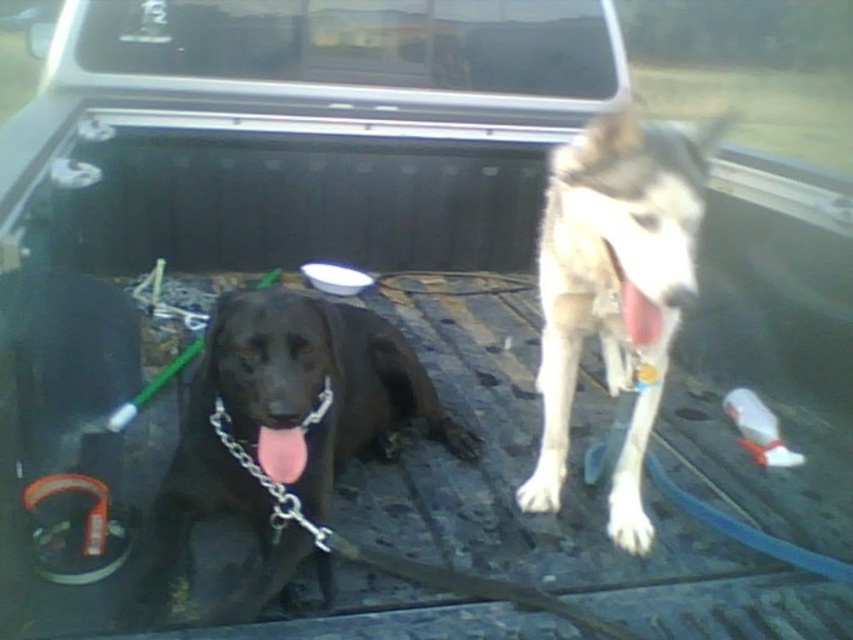
You are standing in front of the pickup truck bed and want to place a new water bowl between the two points marked as point (451, 444) and point (543, 305). Which point should the bowl be closer to so it stays within the truck bed?

The water bowl should be placed closer to point (543, 305) because point (451, 444) is further away from the camera, meaning it is closer to the front of the truck bed. Placing the bowl closer to the rear point ensures it stays within the bed.

You are a veterinarian assessing the space in the truck bed for these two dogs. Given that the truck bed has a width of 1.2 meters, and the shiny black dog at center takes up more space than the white fur dog at center, can both dogs comfortably fit side by side without overcrowding?

The shiny black dog at center is larger in width than the white fur dog at center. Since the truck bed is 1.2 meters wide, both dogs can fit side by side as long as their combined widths do not exceed the bed width. However, without exact measurements, it is recommended to ensure there is enough space for them to move comfortably.